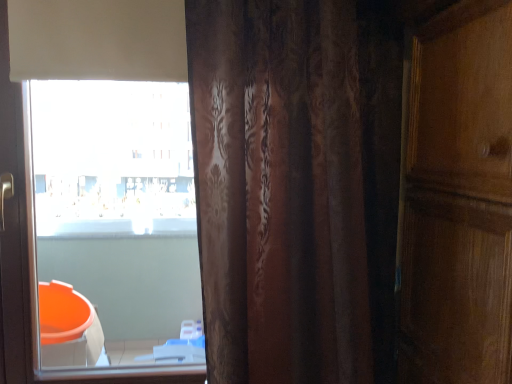
Describe the element at coordinates (34, 258) in the screenshot. I see `white matte window at upper left` at that location.

Locate an element on the screen. Image resolution: width=512 pixels, height=384 pixels. white matte window at upper left is located at coordinates (34, 258).

I want to click on brown textured curtain at center, so click(353, 189).

Describe the element at coordinates (353, 189) in the screenshot. I see `brown textured curtain at center` at that location.

Measure the distance between point (378, 159) and camera.

A distance of 39.29 inches exists between point (378, 159) and camera.

You are a GUI agent. You are given a task and a screenshot of the screen. Output one action in this format:
    pyautogui.click(x=<x>, y=<y>)
    Task: Click on the white matte window at upper left
    
    Given the screenshot: What is the action you would take?
    pyautogui.click(x=34, y=258)

Is white matte window at upper left at the left side of brown textured curtain at center?

Yes, white matte window at upper left is to the left of brown textured curtain at center.

Considering the relative positions of white matte window at upper left and brown textured curtain at center in the image provided, is white matte window at upper left behind brown textured curtain at center?

That is True.

Which is closer to the camera, (30, 237) or (470, 159)?

Positioned in front is point (470, 159).

From the image's perspective, relative to brown textured curtain at center, is white matte window at upper left above or below?

Clearly, from the image's perspective, white matte window at upper left is above brown textured curtain at center.

From a real-world perspective, which object stands above the other?

In real-world perspective, brown textured curtain at center is above.

Considering the relative sizes of white matte window at upper left and brown textured curtain at center in the image provided, is white matte window at upper left thinner than brown textured curtain at center?

Indeed, white matte window at upper left has a lesser width compared to brown textured curtain at center.

Who is shorter, white matte window at upper left or brown textured curtain at center?

brown textured curtain at center.

Which of these two, white matte window at upper left or brown textured curtain at center, is bigger?

With larger size is brown textured curtain at center.

In the scene shown: Is white matte window at upper left not within brown textured curtain at center?

Yes, white matte window at upper left is outside of brown textured curtain at center.

In the scene shown: Is white matte window at upper left not near brown textured curtain at center?

Actually, white matte window at upper left and brown textured curtain at center are a little close together.

Is white matte window at upper left oriented towards brown textured curtain at center?

No, white matte window at upper left is not facing towards brown textured curtain at center.

Looking at this image, can you tell me how much white matte window at upper left and brown textured curtain at center differ in facing direction?

The angle between the facing direction of white matte window at upper left and the facing direction of brown textured curtain at center is 0.615 degrees.

You are a GUI agent. You are given a task and a screenshot of the screen. Output one action in this format:
    pyautogui.click(x=<x>, y=<y>)
    Task: Click on the curtain lying on the right of white matte window at upper left
    The height and width of the screenshot is (384, 512).
    Given the screenshot: What is the action you would take?
    (x=353, y=189)

Which is more to the right, brown textured curtain at center or white matte window at upper left?

From the viewer's perspective, brown textured curtain at center appears more on the right side.

In the scene shown: Who is more distant, brown textured curtain at center or white matte window at upper left?

white matte window at upper left is further from the camera.

Is point (380, 16) behind point (21, 191)?

No, (380, 16) is in front of (21, 191).

From the image's perspective, is brown textured curtain at center located above or below white matte window at upper left?

brown textured curtain at center is situated lower than white matte window at upper left in the image.

From a real-world perspective, between brown textured curtain at center and white matte window at upper left, who is vertically higher?

brown textured curtain at center.

Considering the relative sizes of brown textured curtain at center and white matte window at upper left in the image provided, is brown textured curtain at center wider than white matte window at upper left?

Indeed, brown textured curtain at center has a greater width compared to white matte window at upper left.

Does brown textured curtain at center have a lesser height compared to white matte window at upper left?

Correct, brown textured curtain at center is not as tall as white matte window at upper left.

Does brown textured curtain at center have a smaller size compared to white matte window at upper left?

No.

Does brown textured curtain at center contain white matte window at upper left?

No, white matte window at upper left is not a part of brown textured curtain at center.

Based on the photo, is brown textured curtain at center far from white matte window at upper left?

brown textured curtain at center is actually quite close to white matte window at upper left.

Is brown textured curtain at center positioned with its back to white matte window at upper left?

No, white matte window at upper left is not at the back of brown textured curtain at center.

How many degrees apart are the facing directions of brown textured curtain at center and white matte window at upper left?

The facing directions of brown textured curtain at center and white matte window at upper left are 0.615 degrees apart.

In the image, there is a brown textured curtain at center. Where is `window below it (from a real-world perspective)`? This screenshot has height=384, width=512. window below it (from a real-world perspective) is located at coordinates coord(34,258).

Locate an element on the screen. The width and height of the screenshot is (512, 384). window above the brown textured curtain at center (from the image's perspective) is located at coordinates (34, 258).

I want to click on window on the left of brown textured curtain at center, so click(34, 258).